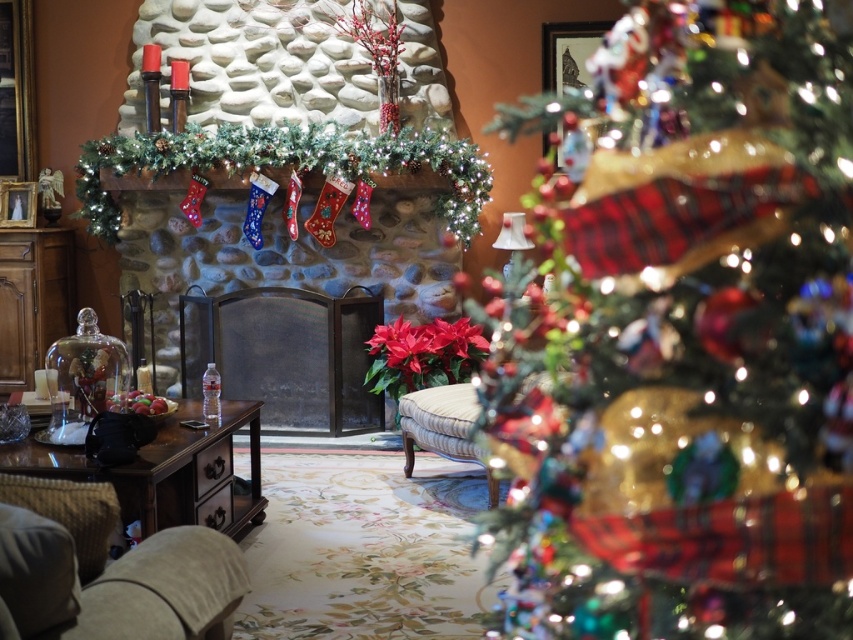
Question: Does shiny metallic ornaments at center have a greater width compared to beige fabric armchair at lower left?

Choices:
 (A) no
 (B) yes

Answer: (A)

Question: Which point is farther to the camera?

Choices:
 (A) (585, 125)
 (B) (82, 598)
 (C) (381, 364)
 (D) (416, 184)

Answer: (C)

Question: Does shiny metallic ornaments at center come behind beige fabric armchair at lower left?

Choices:
 (A) no
 (B) yes

Answer: (A)

Question: Which of these objects is positioned farthest from the red matte poinsettia at center?

Choices:
 (A) metallic fireplace screen at center
 (B) beige fabric armchair at lower left
 (C) shiny metallic ornaments at center

Answer: (B)

Question: Which is farther from the red matte poinsettia at center?

Choices:
 (A) shiny metallic ornaments at center
 (B) metallic fireplace screen at center

Answer: (A)

Question: Is shiny metallic ornaments at center above metallic fireplace screen at center?

Choices:
 (A) yes
 (B) no

Answer: (B)